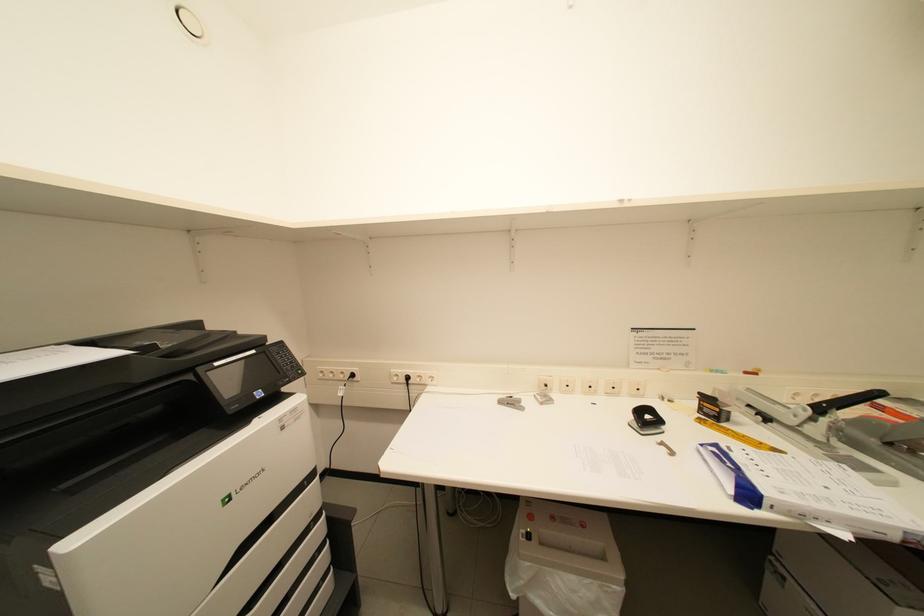
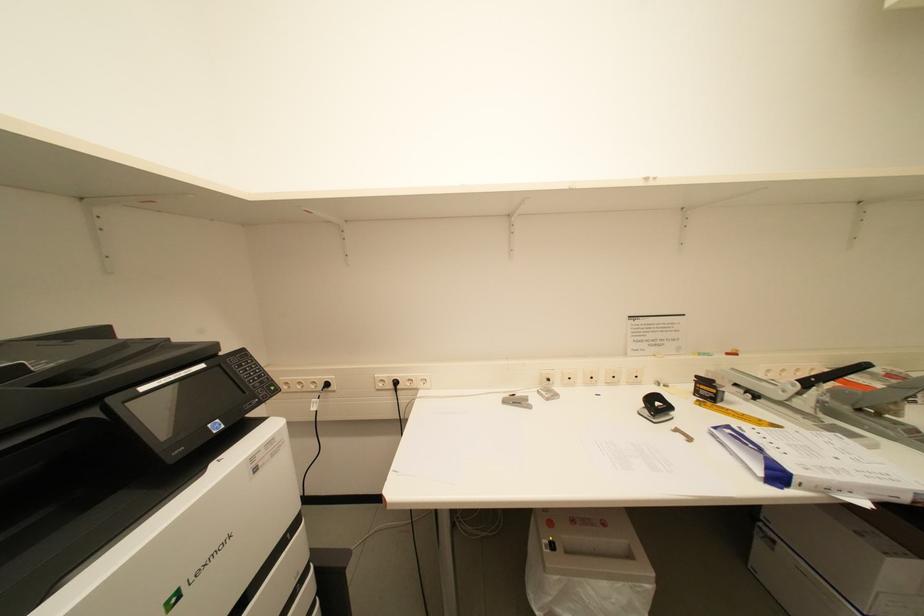
Question: The camera is either moving clockwise (left) or counter-clockwise (right) around the object. The first image is from the beginning of the video and the second image is from the end. Is the camera moving left or right when shooting the video?

Choices:
 (A) Left
 (B) Right

Answer: (A)